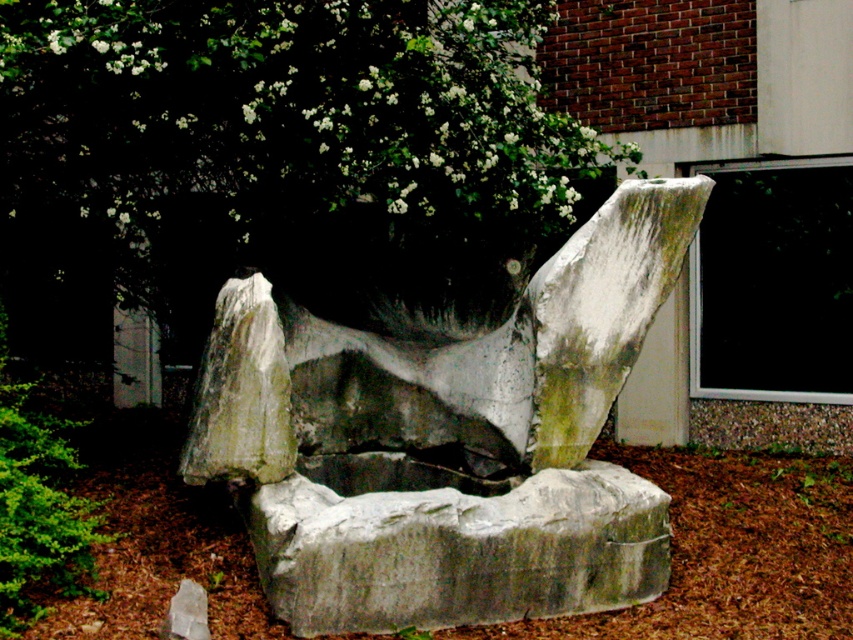
Question: Which is nearer to the brown mulch at center?

Choices:
 (A) green leafy tree at upper center
 (B) gray stone boulder at center
 (C) gray stone sculpture at center

Answer: (B)

Question: Does brown mulch at center lie in front of gray stone boulder at center?

Choices:
 (A) no
 (B) yes

Answer: (A)

Question: Can you confirm if gray stone sculpture at center is wider than green leafy tree at upper center?

Choices:
 (A) yes
 (B) no

Answer: (B)

Question: Can you confirm if gray stone sculpture at center is bigger than gray stone boulder at center?

Choices:
 (A) no
 (B) yes

Answer: (B)

Question: Which of these objects is positioned farthest from the green leafy tree at upper center?

Choices:
 (A) brown mulch at center
 (B) gray stone sculpture at center
 (C) gray stone boulder at center

Answer: (A)

Question: Which of these objects is positioned farthest from the brown mulch at center?

Choices:
 (A) gray stone sculpture at center
 (B) gray stone boulder at center

Answer: (A)